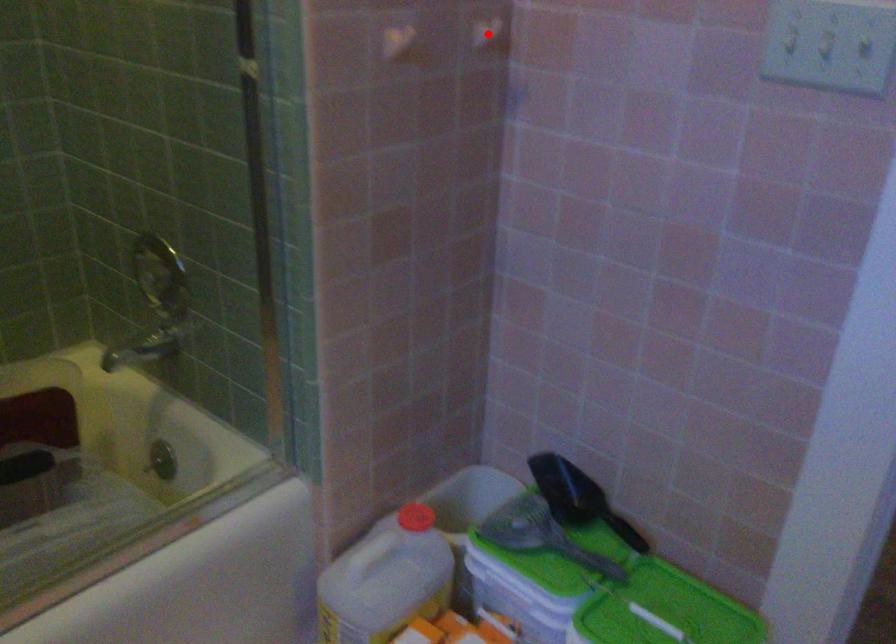
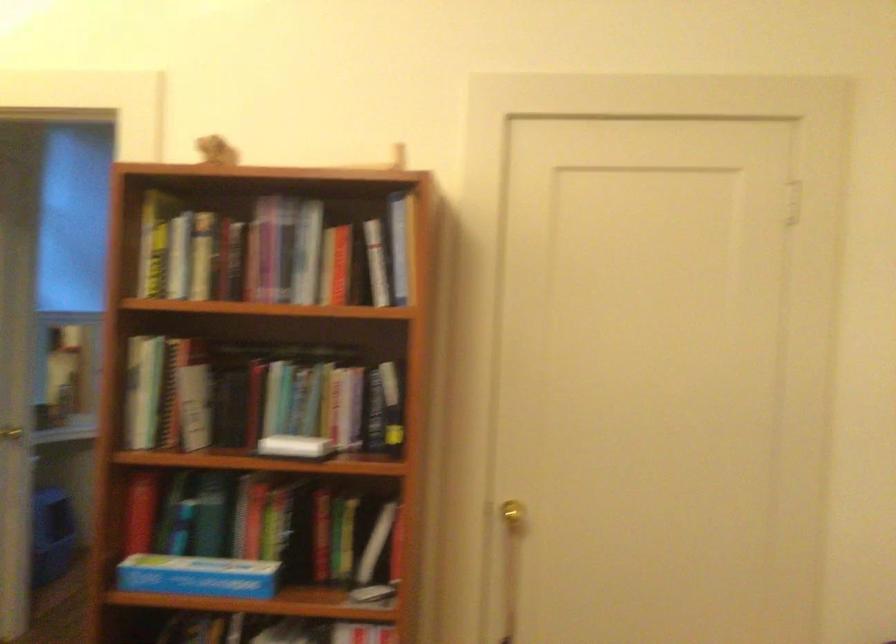
Question: I am providing you with two images of the same scene from different viewpoints. A red point is marked on the first image. Can you still see the location of the red point in image 2?

Choices:
 (A) Yes
 (B) No

Answer: (B)